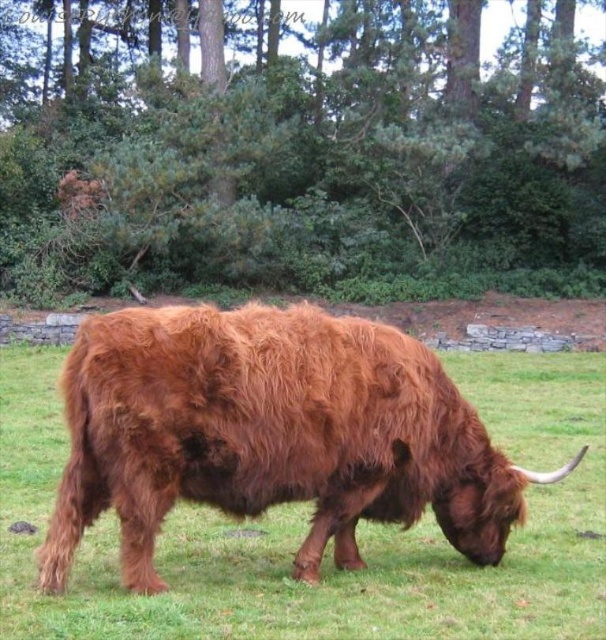
Question: Which point is closer to the camera taking this photo?

Choices:
 (A) (539, 49)
 (B) (242, 483)

Answer: (B)

Question: Which point appears closest to the camera in this image?

Choices:
 (A) (165, 458)
 (B) (298, 236)

Answer: (A)

Question: Does green leafy tree at center have a greater width compared to brown fuzzy bull at center?

Choices:
 (A) no
 (B) yes

Answer: (B)

Question: Is green leafy tree at center to the left of brown fuzzy bull at center from the viewer's perspective?

Choices:
 (A) no
 (B) yes

Answer: (B)

Question: Which point is closer to the camera taking this photo?

Choices:
 (A) (413, 387)
 (B) (144, 163)

Answer: (A)

Question: Does green leafy tree at center appear on the left side of brown fuzzy bull at center?

Choices:
 (A) no
 (B) yes

Answer: (B)